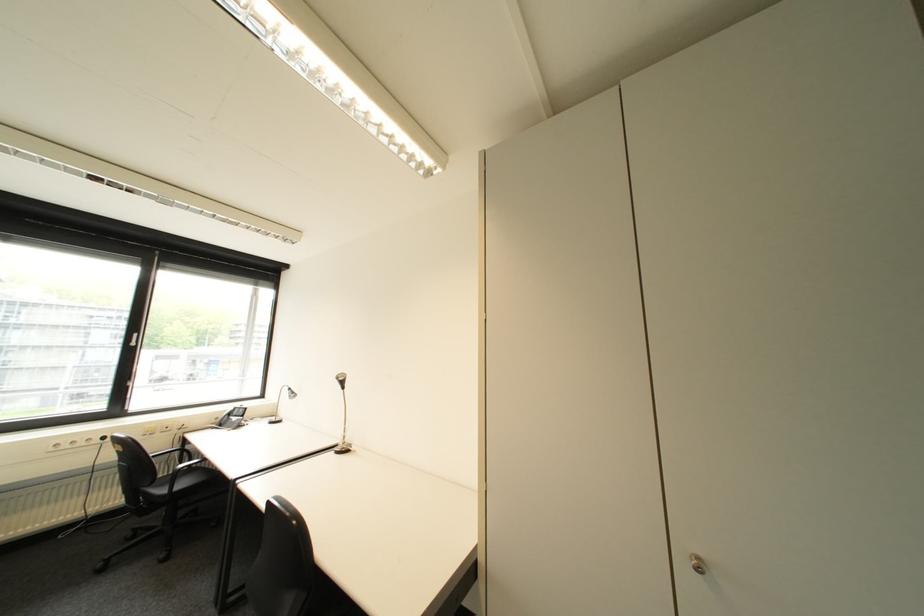
The width and height of the screenshot is (924, 616). What do you see at coordinates (181, 464) in the screenshot? I see `the black chair armrest` at bounding box center [181, 464].